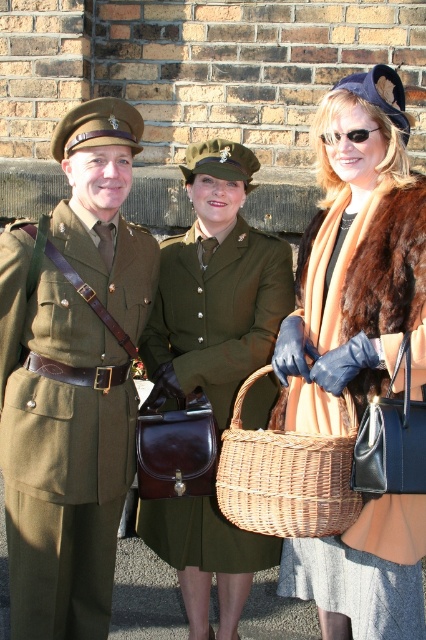
Question: Which object appears farthest from the camera in this image?

Choices:
 (A) woven brown basket at center
 (B) fur coat at center
 (C) matte olive-green uniform at center
 (D) olive green fabric uniform at center

Answer: (D)

Question: Is matte olive-green uniform at center behind fur coat at center?

Choices:
 (A) yes
 (B) no

Answer: (A)

Question: Which object is closer to the camera taking this photo?

Choices:
 (A) fur coat at center
 (B) olive green fabric uniform at center
 (C) matte olive-green uniform at center

Answer: (A)

Question: Which point is closer to the camera?

Choices:
 (A) (65, 339)
 (B) (310, 483)
 (C) (419, 308)
 (D) (184, 282)

Answer: (B)

Question: Can you confirm if matte olive-green uniform at center is bigger than olive green fabric uniform at center?

Choices:
 (A) yes
 (B) no

Answer: (A)

Question: Observing the image, what is the correct spatial positioning of fur coat at center in reference to woven brown basket at center?

Choices:
 (A) left
 (B) right

Answer: (B)